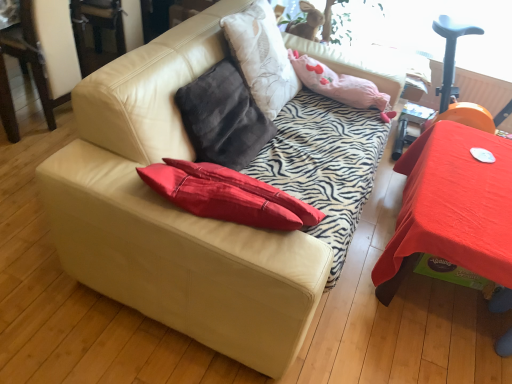
Question: Looking at the image, does smooth red table at right seem bigger or smaller compared to fuzzy beige rabbit at upper center?

Choices:
 (A) small
 (B) big

Answer: (B)

Question: From their relative heights in the image, would you say smooth red table at right is taller or shorter than fuzzy beige rabbit at upper center?

Choices:
 (A) short
 (B) tall

Answer: (B)

Question: Estimate the real-world distances between objects in this image. Which object is closer to the pink fabric pillow at upper center?

Choices:
 (A) smooth red table at right
 (B) fuzzy beige rabbit at upper center
 (C) beige leather couch at center

Answer: (B)

Question: Based on their relative distances, which object is farther from the pink fabric pillow at upper center?

Choices:
 (A) fuzzy beige rabbit at upper center
 (B) smooth red table at right
 (C) beige leather couch at center

Answer: (C)